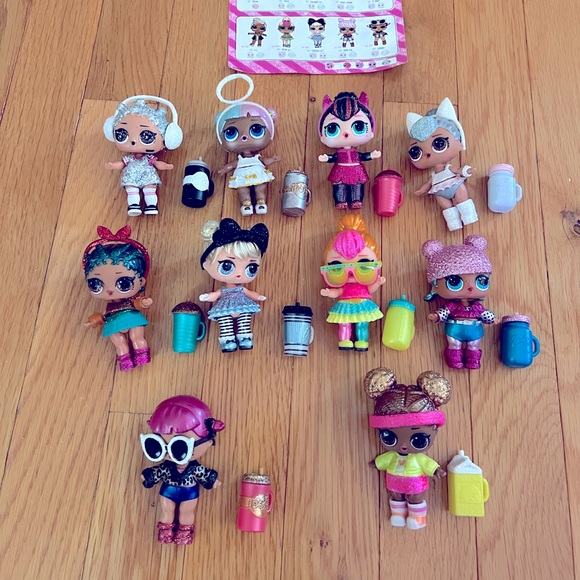
Identify the location of doll baby bottles. (190, 193), (292, 204), (392, 195), (510, 191), (518, 324), (394, 328), (290, 329), (172, 333), (258, 495), (481, 476).